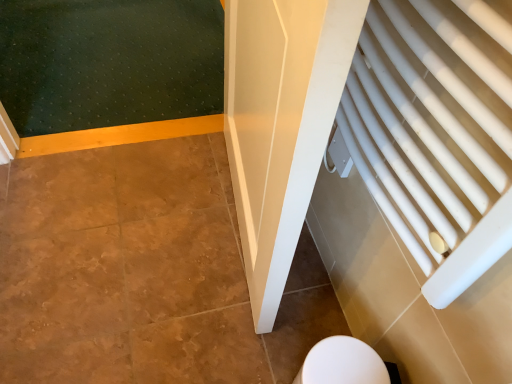
Question: Should I look upward or downward to see white glossy toilet at lower center?

Choices:
 (A) down
 (B) up

Answer: (A)

Question: Does white plastic radiator at right have a greater width compared to white glossy toilet at lower center?

Choices:
 (A) no
 (B) yes

Answer: (A)

Question: From the image's perspective, is white plastic radiator at right over white glossy toilet at lower center?

Choices:
 (A) no
 (B) yes

Answer: (B)

Question: Is the position of white plastic radiator at right less distant than that of white glossy toilet at lower center?

Choices:
 (A) no
 (B) yes

Answer: (B)

Question: Is white plastic radiator at right oriented towards white glossy toilet at lower center?

Choices:
 (A) yes
 (B) no

Answer: (B)

Question: Is white plastic radiator at right completely or partially outside of white glossy toilet at lower center?

Choices:
 (A) yes
 (B) no

Answer: (A)

Question: Can you confirm if white plastic radiator at right is positioned to the right of white glossy toilet at lower center?

Choices:
 (A) yes
 (B) no

Answer: (A)

Question: Is white glossy toilet at lower center positioned before white plastic radiator at right?

Choices:
 (A) yes
 (B) no

Answer: (B)

Question: Is white glossy toilet at lower center behind white plastic radiator at right?

Choices:
 (A) yes
 (B) no

Answer: (A)

Question: From the image's perspective, is white glossy toilet at lower center below white plastic radiator at right?

Choices:
 (A) yes
 (B) no

Answer: (A)

Question: Does white glossy toilet at lower center have a smaller size compared to white plastic radiator at right?

Choices:
 (A) no
 (B) yes

Answer: (B)

Question: Does white glossy toilet at lower center have a lesser height compared to white plastic radiator at right?

Choices:
 (A) no
 (B) yes

Answer: (B)

Question: Are white glossy toilet at lower center and white plastic radiator at right making contact?

Choices:
 (A) yes
 (B) no

Answer: (B)

Question: Considering their positions, is white glossy toilet at lower center located in front of or behind white plastic radiator at right?

Choices:
 (A) behind
 (B) front

Answer: (A)